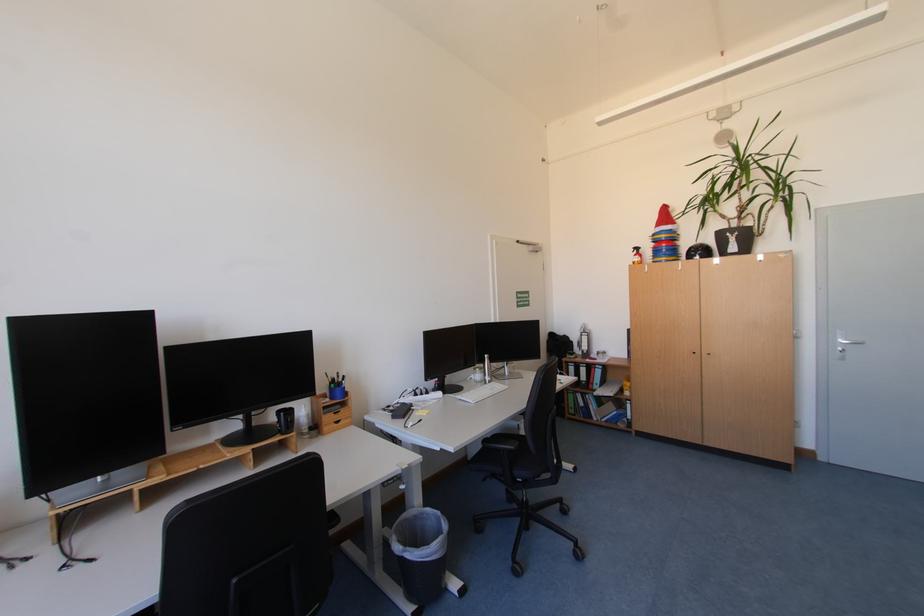
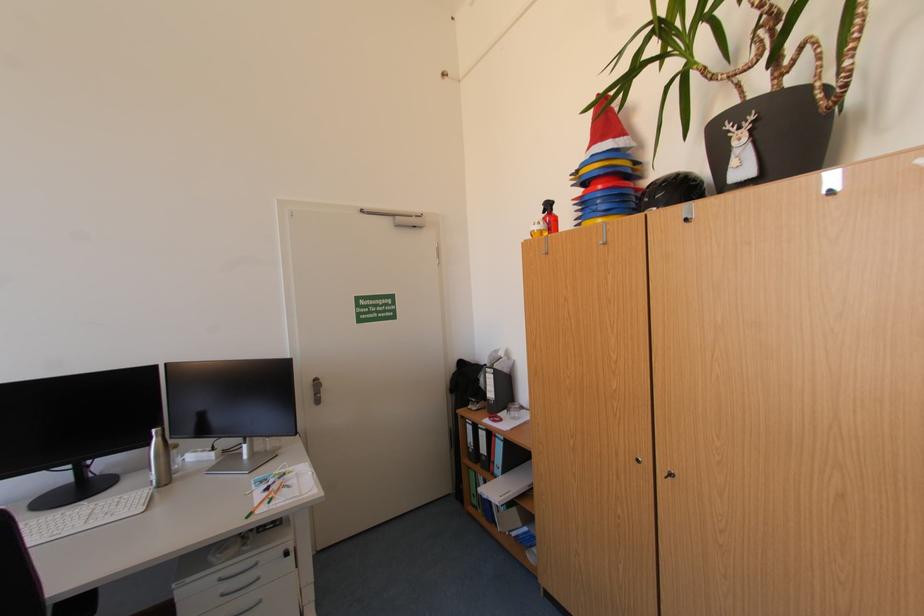
In the second image, find the point that corresponds to point 493,357 in the first image.

(161, 431)